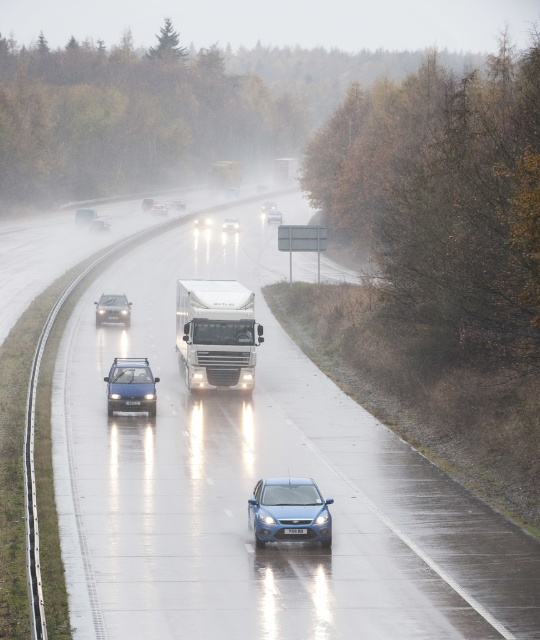
You are a pedestrian standing on the roadside guardrail. You see a glossy metallic car at center approaching you. Can you safely step onto the road to cross before the car reaches your current position?

The glossy metallic car at center is 18.02 meters away from you. Since the car is approaching, you need to consider your walking speed and the car speed to determine if you can cross safely. However, without knowing the car speed, it is impossible to accurately determine if you can cross safely before the car reaches your current position.

You are a driver approaching the white plastic license plate at center and the glossy plastic headlight at center on a wet highway. Which object is closer to the front of the car?

The white plastic license plate at center is positioned under the glossy plastic headlight at center, so the glossy plastic headlight at center is closer to the front of the car.

In the scene shown: What is the color and type of the vehicle located at the coordinates point (x=131, y=387)?

The vehicle at point (x=131, y=387) is a blue matte hatchback.